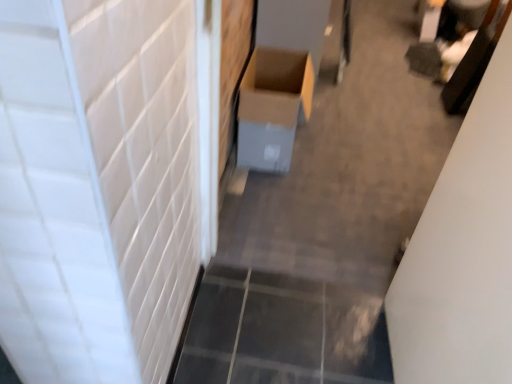
Find the location of a particular element. vacant space to the right of cardboard box at center is located at coordinates (328, 165).